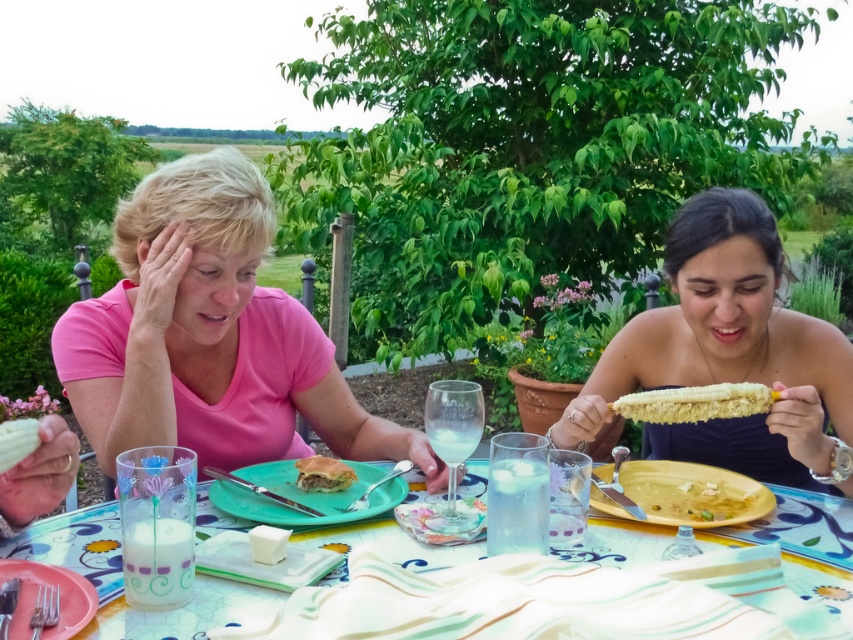
Question: Can you confirm if plastic pink plate at lower left is thinner than brown matte sandwich at center?

Choices:
 (A) no
 (B) yes

Answer: (A)

Question: Estimate the real-world distances between objects in this image. Which object is farther from the plastic pink plate at lower left?

Choices:
 (A) porcelain plate at center
 (B) brown matte sandwich at center

Answer: (B)

Question: Among these objects, which one is nearest to the camera?

Choices:
 (A) plastic pink plate at lower left
 (B) brown matte sandwich at center

Answer: (A)

Question: Which object appears farthest from the camera in this image?

Choices:
 (A) yellow corn cob at right
 (B) yellow matte plate at lower right
 (C) green matte plate at center

Answer: (A)

Question: Can you confirm if smooth yellow corn at right is positioned to the right of plastic pink plate at lower left?

Choices:
 (A) yes
 (B) no

Answer: (A)

Question: Does yellow matte plate at lower right appear under green matte plate at center?

Choices:
 (A) yes
 (B) no

Answer: (A)